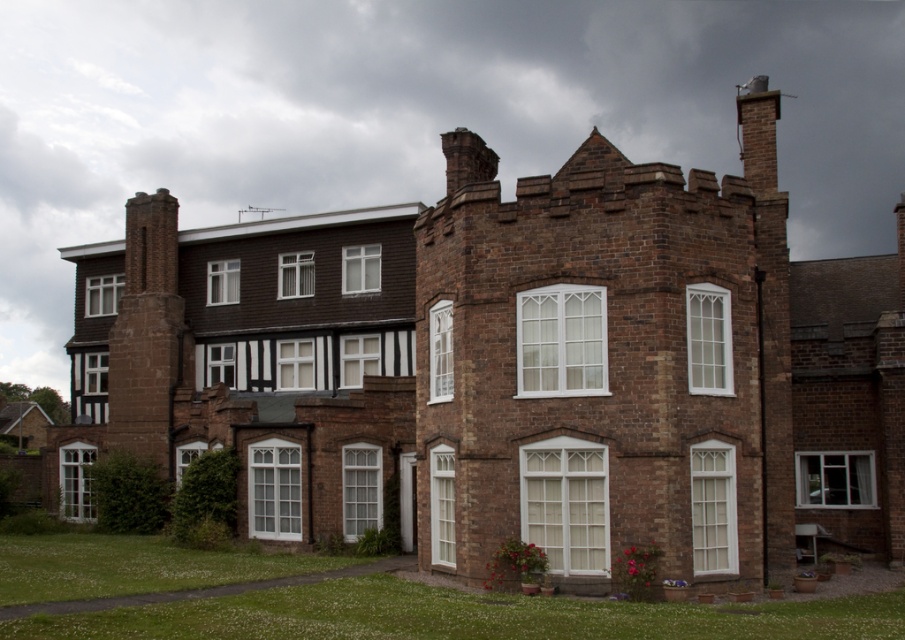
Question: In this image, where is brown brick chimney at upper right located relative to brown stone chimney at left?

Choices:
 (A) left
 (B) right

Answer: (B)

Question: Is brown brick chimney at upper right positioned before brown stone chimney at left?

Choices:
 (A) yes
 (B) no

Answer: (A)

Question: Which object appears farthest from the camera in this image?

Choices:
 (A) brown stone chimney at left
 (B) brown brick chimney at upper right

Answer: (A)

Question: Which object is closer to the camera taking this photo?

Choices:
 (A) brown brick chimney at upper right
 (B) brown stone chimney at left

Answer: (A)

Question: Is brown brick chimney at upper right in front of brown stone chimney at left?

Choices:
 (A) yes
 (B) no

Answer: (A)